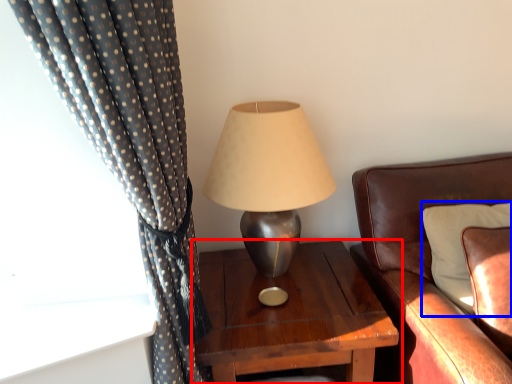
Question: Which object is closer to the camera taking this photo, nightstand (highlighted by a red box) or pillow (highlighted by a blue box)?

Choices:
 (A) nightstand
 (B) pillow

Answer: (B)